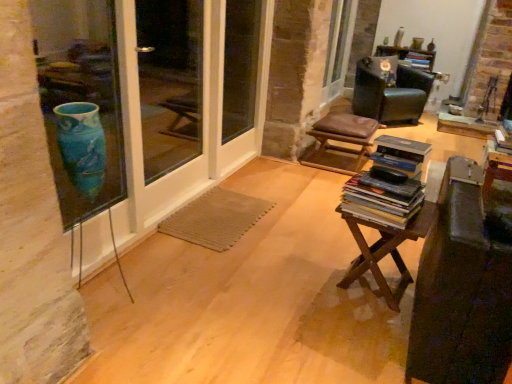
This screenshot has height=384, width=512. Describe the element at coordinates (80, 98) in the screenshot. I see `blue glass vase at left` at that location.

The width and height of the screenshot is (512, 384). What are the coordinates of `wooden at center` in the screenshot? It's located at (385, 250).

Locate an element on the screen. The image size is (512, 384). hardcover book at upper right, which appears as the 2th book when viewed from the front is located at coordinates (420, 59).

In order to click on hardcover books at center, which ranks as the 2th book in right-to-left order in this screenshot , I will do `click(389, 183)`.

You are a GUI agent. You are given a task and a screenshot of the screen. Output one action in this format:
    pyautogui.click(x=<x>, y=<y>)
    Task: Click on the black leather chair at upper right
    
    Given the screenshot: What is the action you would take?
    pyautogui.click(x=390, y=91)

Image resolution: width=512 pixels, height=384 pixels. Identify the location of window that is above the wooden at center (from the image's perspective). (80, 98).

Would you say wooden at center is outside blue glass vase at left?

Absolutely, wooden at center is external to blue glass vase at left.

Consider the image. Considering the relative positions of wooden at center and blue glass vase at left in the image provided, is wooden at center behind blue glass vase at left?

Yes, wooden at center is behind blue glass vase at left.

From the image's perspective, which object appears higher, wooden at center or blue glass vase at left?

blue glass vase at left is shown above in the image.

In the scene shown: Which object is positioned more to the right, hardcover books at center, the second book from the top, or hardcover book at upper right, the 1th book viewed from the top?

From the viewer's perspective, hardcover book at upper right, the 1th book viewed from the top, appears more on the right side.

Which object is wider, hardcover books at center, which ranks as the 1th book in front-to-back order, or hardcover book at upper right, arranged as the 2th book when viewed from the left?

hardcover books at center, which ranks as the 1th book in front-to-back order, is wider.

Is hardcover books at center, which is counted as the second book, starting from the back, facing away from hardcover book at upper right, which appears as the 2th book when viewed from the front?

That's not correct — hardcover books at center, which is counted as the second book, starting from the back, is not looking away from hardcover book at upper right, which appears as the 2th book when viewed from the front.

Would you consider brown leather stool at center to be distant from blue glass vase at left?

brown leather stool at center is far away from blue glass vase at left.

From the image's perspective, does brown leather stool at center appear higher than blue glass vase at left?

Correct, brown leather stool at center appears higher than blue glass vase at left in the image.

You are a GUI agent. You are given a task and a screenshot of the screen. Output one action in this format:
    pyautogui.click(x=<x>, y=<y>)
    Task: Click on the stool behind the blue glass vase at left
    This screenshot has height=384, width=512.
    Given the screenshot: What is the action you would take?
    pyautogui.click(x=343, y=138)

Who is bigger, brown leather stool at center or blue glass vase at left?

With larger size is brown leather stool at center.

Is wooden at center at the right side of hardcover books at center, which ranks as the 1th book in front-to-back order?

Indeed, wooden at center is positioned on the right side of hardcover books at center, which ranks as the 1th book in front-to-back order.

Relative to hardcover books at center, which is the 1th book in left-to-right order, is wooden at center in front or behind?

Visually, wooden at center is located behind hardcover books at center, which is the 1th book in left-to-right order.

Considering the positions of points (395, 260) and (387, 222), is point (395, 260) closer to camera compared to point (387, 222)?

No, (395, 260) is behind (387, 222).

Considering the sizes of objects wooden at center and hardcover books at center, which ranks as the 1th book in front-to-back order, in the image provided, who is thinner, wooden at center or hardcover books at center, which ranks as the 1th book in front-to-back order,?

With smaller width is hardcover books at center, which ranks as the 1th book in front-to-back order.

From the image's perspective, relative to wooden at center, is blue glass vase at left above or below?

From the image's perspective, blue glass vase at left appears above wooden at center.

Considering the sizes of blue glass vase at left and wooden at center in the image, is blue glass vase at left wider or thinner than wooden at center?

Considering their sizes, blue glass vase at left looks slimmer than wooden at center.

In terms of size, does blue glass vase at left appear bigger or smaller than wooden at center?

In the image, blue glass vase at left appears to be smaller than wooden at center.

Is blue glass vase at left in front of or behind wooden at center in the image?

Clearly, blue glass vase at left is in front of wooden at center.

How distant is hardcover books at center, which appears as the first book when ordered from the bottom, from clear glass screen door at left?

hardcover books at center, which appears as the first book when ordered from the bottom, is 4.48 feet away from clear glass screen door at left.

Can you confirm if hardcover books at center, which appears as the first book when ordered from the bottom, is wider than clear glass screen door at left?

Correct, the width of hardcover books at center, which appears as the first book when ordered from the bottom, exceeds that of clear glass screen door at left.

Which object is more forward, hardcover books at center, which ranks as the 1th book in front-to-back order, or clear glass screen door at left?

Positioned in front is hardcover books at center, which ranks as the 1th book in front-to-back order.

From a real-world perspective, relative to clear glass screen door at left, is hardcover books at center, which appears as the first book when ordered from the bottom, vertically above or below?

In terms of real-world spatial position, hardcover books at center, which appears as the first book when ordered from the bottom, is below clear glass screen door at left.

Who is bigger, brown leather stool at center or hardcover books at center, which ranks as the 2th book in right-to-left order?

brown leather stool at center is bigger.

Could you measure the distance between brown leather stool at center and hardcover books at center, which is counted as the second book, starting from the back?

The distance of brown leather stool at center from hardcover books at center, which is counted as the second book, starting from the back, is 1.65 meters.

Is brown leather stool at center placed right next to hardcover books at center, which is counted as the second book, starting from the back?

No, brown leather stool at center is not making contact with hardcover books at center, which is counted as the second book, starting from the back.

The image size is (512, 384). Find the location of `book that appears on the left of brown leather stool at center`. book that appears on the left of brown leather stool at center is located at coordinates pyautogui.click(x=389, y=183).

Image resolution: width=512 pixels, height=384 pixels. I want to click on window that is on the left side of wooden at center, so click(80, 98).

At what (x,y) coordinates should I click in order to perform the action: click on book that appears in front of the hardcover book at upper right, which is counted as the 1th book, starting from the back. Please return your answer as a coordinate pair (x, y). Looking at the image, I should click on (389, 183).

Considering their positions, is clear glass screen door at left positioned closer to hardcover book at upper right, which appears as the 2th book when viewed from the front, than black leather chair at upper right?

The object closer to hardcover book at upper right, which appears as the 2th book when viewed from the front, is black leather chair at upper right.

Looking at the image, which one is located closer to hardcover books at center, which is counted as the second book, starting from the back, blue glass vase at left or black leather chair at upper right?

blue glass vase at left is closer to hardcover books at center, which is counted as the second book, starting from the back.

Based on the photo, based on their spatial positions, is brown leather stool at center or wooden at center further from black leather chair at upper right?

The object further to black leather chair at upper right is wooden at center.

Estimate the real-world distances between objects in this image. Which object is further from brown leather stool at center, blue glass vase at left or wooden at center?

A: blue glass vase at left.

In the scene shown: Estimate the real-world distances between objects in this image. Which object is further from brown leather stool at center, clear glass screen door at left or blue glass vase at left?

blue glass vase at left is further to brown leather stool at center.

Estimate the real-world distances between objects in this image. Which object is closer to wooden at center, clear glass screen door at left or blue glass vase at left?

clear glass screen door at left is closer to wooden at center.

When comparing their distances from hardcover books at center, which appears as the first book when ordered from the bottom, does blue glass vase at left or hardcover book at upper right, which appears as the 2th book when viewed from the front, seem further?

hardcover book at upper right, which appears as the 2th book when viewed from the front.

Based on their spatial positions, is hardcover books at center, the second book from the top, or blue glass vase at left closer to hardcover book at upper right, the 1th book viewed from the top?

Among the two, blue glass vase at left is located nearer to hardcover book at upper right, the 1th book viewed from the top.

What are the coordinates of `screen door located between wooden at center and hardcover book at upper right, which is counted as the 1th book, starting from the back, in the depth direction` in the screenshot? It's located at (191, 98).

Find the location of a particular element. book between blue glass vase at left and brown leather stool at center in the front-back direction is located at coordinates (389, 183).

This screenshot has height=384, width=512. What are the coordinates of `screen door between hardcover books at center, which ranks as the 1th book in front-to-back order, and hardcover book at upper right, which is counted as the 1th book, starting from the back, in the front-back direction` in the screenshot? It's located at (191, 98).

Identify the location of stool located between wooden at center and black leather chair at upper right in the depth direction. (343, 138).